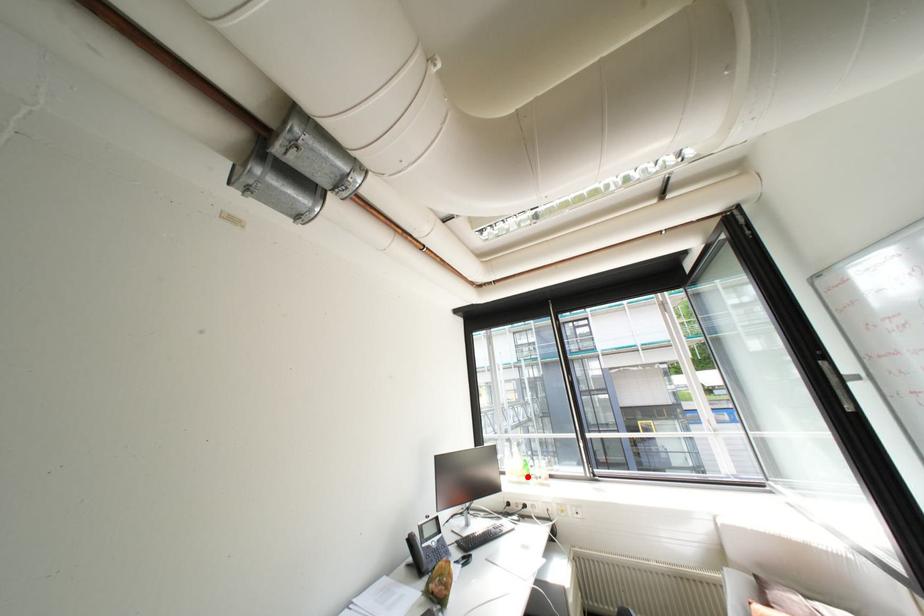
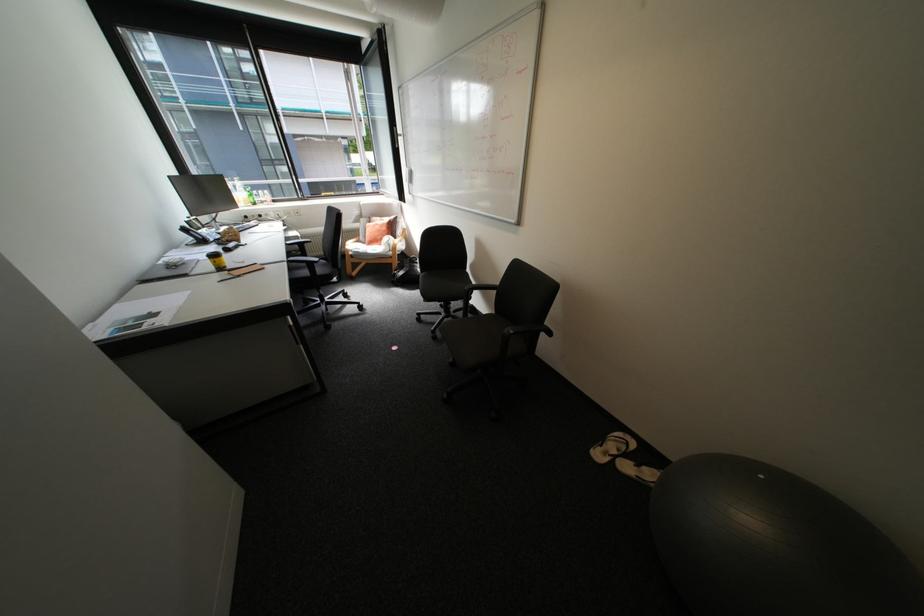
The point at the highlighted location is marked in the first image. Where is the corresponding point in the second image?

(256, 204)